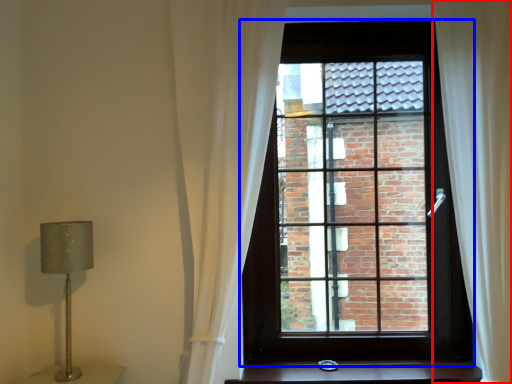
Question: Which object appears closest to the camera in this image, curtain (highlighted by a red box) or window (highlighted by a blue box)?

Choices:
 (A) curtain
 (B) window

Answer: (A)